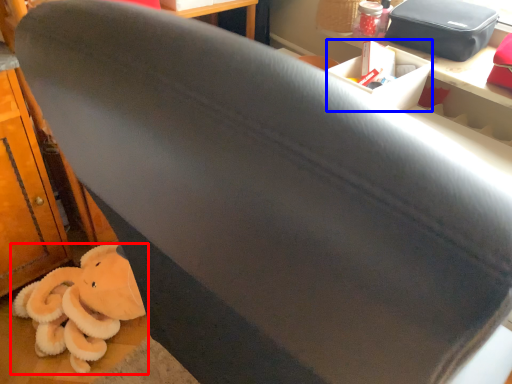
Question: Which object is further to the camera taking this photo, toy (highlighted by a red box) or box (highlighted by a blue box)?

Choices:
 (A) toy
 (B) box

Answer: (A)